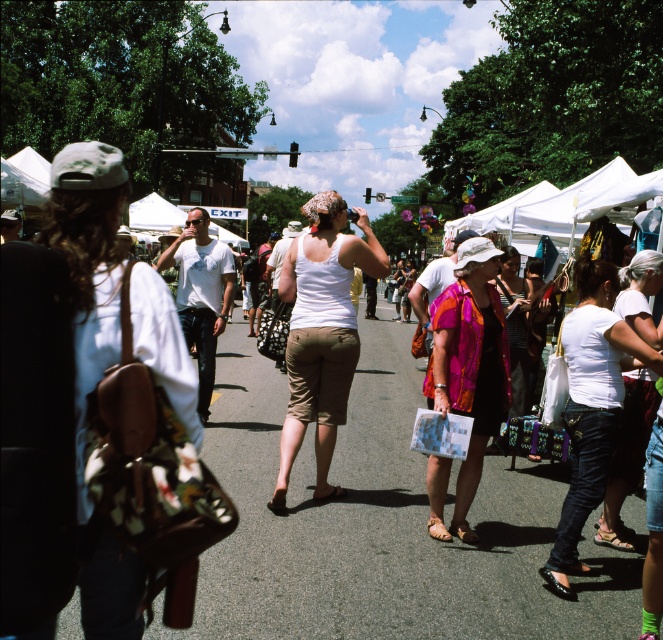
Question: In this image, where is white matte tank top at center located relative to white cotton t-shirt at center?

Choices:
 (A) below
 (B) above

Answer: (B)

Question: Observing the image, what is the correct spatial positioning of multicolored fabric dress at center in reference to white cotton t-shirt at center?

Choices:
 (A) right
 (B) left

Answer: (A)

Question: Which object is positioned farthest from the white matte tank top at center?

Choices:
 (A) white cotton t-shirt at center
 (B) brown leather backpack at left

Answer: (B)

Question: Which point appears farthest from the camera in this image?

Choices:
 (A) pyautogui.click(x=591, y=305)
 (B) pyautogui.click(x=326, y=301)
 (C) pyautogui.click(x=646, y=285)
 (D) pyautogui.click(x=457, y=273)

Answer: (B)

Question: Is brown leather backpack at left thinner than multicolored fabric dress at center?

Choices:
 (A) no
 (B) yes

Answer: (B)

Question: Which of the following is the farthest from the observer?

Choices:
 (A) (326, 196)
 (B) (601, 413)

Answer: (A)